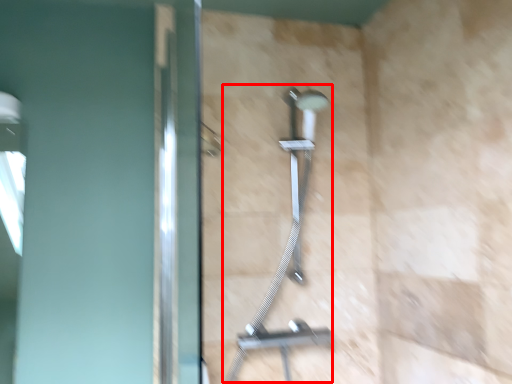
Question: From the image's perspective, what is the correct spatial relationship of shower (annotated by the red box) in relation to screen door?

Choices:
 (A) below
 (B) above

Answer: (A)